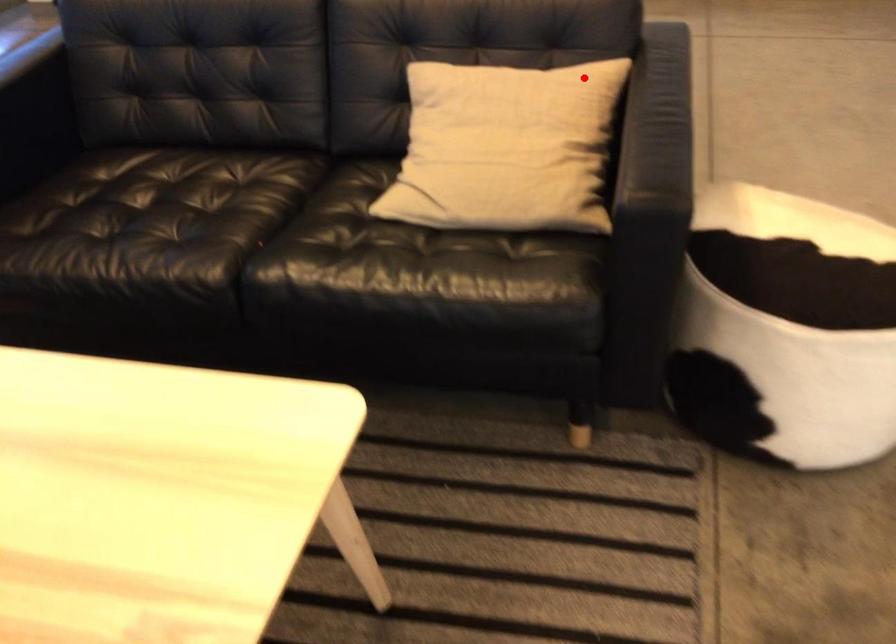
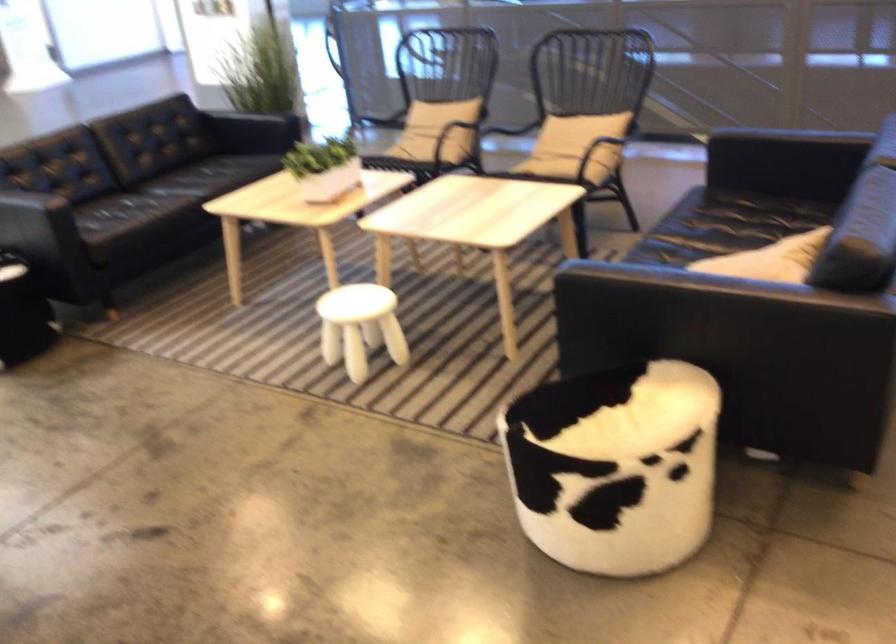
Locate, in the second image, the point that corresponds to the highlighted location in the first image.

(770, 259)